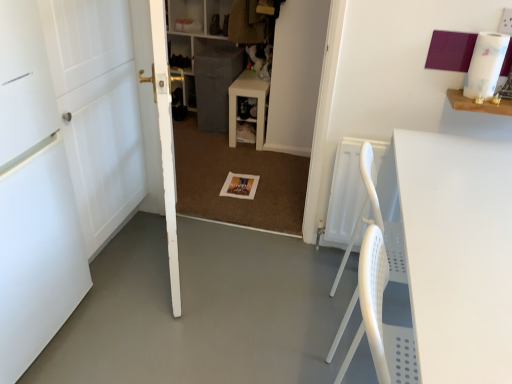
Identify the location of white matte table at right, positioned as the first table in bottom-to-top order. The height and width of the screenshot is (384, 512). (457, 254).

This screenshot has height=384, width=512. What are the coordinates of `white matte door at left, marked as the first door in a left-to-right arrangement` in the screenshot? It's located at (33, 199).

The width and height of the screenshot is (512, 384). I want to click on gray fabric cabinet at center, so click(x=215, y=84).

What do you see at coordinates (215, 84) in the screenshot?
I see `gray fabric cabinet at center` at bounding box center [215, 84].

This screenshot has height=384, width=512. What do you see at coordinates (296, 75) in the screenshot?
I see `gray fabric bookshelf at center` at bounding box center [296, 75].

Locate an element on the screen. The height and width of the screenshot is (384, 512). matte white table at center, arranged as the first table when viewed from the left is located at coordinates coord(248,97).

How much space does white wood door at left, marked as the second door in a left-to-right arrangement, occupy horizontally?

white wood door at left, marked as the second door in a left-to-right arrangement, is 52.31 centimeters wide.

At what (x,y) coordinates should I click in order to perform the action: click on white matte table at right, the 2th table positioned from the top. Please return your answer as a coordinate pair (x, y). The width and height of the screenshot is (512, 384). Looking at the image, I should click on (457, 254).

Is gray fabric cabinet at center further to the viewer compared to white matte table at right, the 2th table positioned from the top?

That is True.

Would you say gray fabric cabinet at center contains white matte table at right, the first table from the right?

No, white matte table at right, the first table from the right, is not inside gray fabric cabinet at center.

Which object is positioned more to the left, gray fabric cabinet at center or white matte table at right, the first table from the right?

gray fabric cabinet at center is more to the left.

Is point (216, 87) in front of point (485, 382)?

That is False.

Is white wooden door at left, the 3th door when ordered from left to right, far from gray fabric bookshelf at center?

white wooden door at left, the 3th door when ordered from left to right, is far away from gray fabric bookshelf at center.

From the image's perspective, who appears lower, white wooden door at left, which is counted as the 1th door, starting from the right, or gray fabric bookshelf at center?

From the image's view, white wooden door at left, which is counted as the 1th door, starting from the right, is below.

Could white matte table at right, the first table from the right, be considered to be inside white wood door at left, marked as the second door in a left-to-right arrangement?

No, white matte table at right, the first table from the right, is not inside white wood door at left, marked as the second door in a left-to-right arrangement.

Is white wood door at left, positioned as the 2th door in right-to-left order, not near white matte table at right, the 2th table positioned from the top?

Yes, white wood door at left, positioned as the 2th door in right-to-left order, is far from white matte table at right, the 2th table positioned from the top.

Considering the positions of objects white wood door at left, positioned as the 2th door in right-to-left order, and white matte table at right, which is the second table from left to right, in the image provided, who is in front, white wood door at left, positioned as the 2th door in right-to-left order, or white matte table at right, which is the second table from left to right,?

white matte table at right, which is the second table from left to right, is in front.

Is white wood door at left, positioned as the 2th door in right-to-left order, facing away from white matte table at right, the first table from the right?

No.

Does point (473, 280) appear closer or farther from the camera than point (32, 225)?

Point (473, 280).

Considering the sizes of objects white matte table at right, which ranks as the 2th table in back-to-front order, and white matte door at left, marked as the first door in a left-to-right arrangement, in the image provided, who is thinner, white matte table at right, which ranks as the 2th table in back-to-front order, or white matte door at left, marked as the first door in a left-to-right arrangement,?

Thinner between the two is white matte table at right, which ranks as the 2th table in back-to-front order.

Is white matte table at right, positioned as the first table in bottom-to-top order, positioned with its back to white matte door at left, the 3th door from the right?

Yes.

Is white matte table at right, which appears as the 1th table when viewed from the front, located outside white matte door at left, marked as the first door in a left-to-right arrangement?

white matte table at right, which appears as the 1th table when viewed from the front, is positioned outside white matte door at left, marked as the first door in a left-to-right arrangement.

Does matte white table at center, arranged as the first table when viewed from the left, have a lesser width compared to white matte door at left, marked as the first door in a left-to-right arrangement?

Yes, matte white table at center, arranged as the first table when viewed from the left, is thinner than white matte door at left, marked as the first door in a left-to-right arrangement.

Which object is closer to the camera, matte white table at center, positioned as the 2th table in bottom-to-top order, or white matte door at left, the 3th door from the right?

white matte door at left, the 3th door from the right, is in front.

Could you tell me if matte white table at center, positioned as the first table in top-to-bottom order, is turned towards white matte door at left, the 3th door from the right?

No.

Which is behind, point (61, 48) or point (259, 105)?

Point (259, 105)

Is white wood door at left, positioned as the 2th door in right-to-left order, positioned with its back to matte white table at center, which is counted as the 1th table, starting from the back?

No, matte white table at center, which is counted as the 1th table, starting from the back, is not at the back of white wood door at left, positioned as the 2th door in right-to-left order.

Between white wood door at left, positioned as the 2th door in right-to-left order, and matte white table at center, arranged as the first table when viewed from the left, which one has more height?

white wood door at left, positioned as the 2th door in right-to-left order, is taller.

Based on their sizes in the image, would you say white wood door at left, marked as the second door in a left-to-right arrangement, is bigger or smaller than matte white table at center, which is counted as the 2th table, starting from the front?

Considering their sizes, white wood door at left, marked as the second door in a left-to-right arrangement, takes up more space than matte white table at center, which is counted as the 2th table, starting from the front.

Is the depth of white matte door at left, the 3th door from the right, greater than that of gray fabric bookshelf at center?

No, the depth of white matte door at left, the 3th door from the right, is less than that of gray fabric bookshelf at center.

Is point (83, 249) farther from camera compared to point (179, 50)?

No.

Considering the sizes of objects white matte door at left, marked as the first door in a left-to-right arrangement, and gray fabric bookshelf at center in the image provided, who is wider, white matte door at left, marked as the first door in a left-to-right arrangement, or gray fabric bookshelf at center?

white matte door at left, marked as the first door in a left-to-right arrangement.

Considering the relative sizes of white matte door at left, the 3th door from the right, and gray fabric bookshelf at center in the image provided, is white matte door at left, the 3th door from the right, shorter than gray fabric bookshelf at center?

No.

The image size is (512, 384). There is a gray fabric cabinet at center. Find the location of `the 2nd table below it (from the image's perspective)`. the 2nd table below it (from the image's perspective) is located at coordinates (457, 254).

I want to click on bookshelf beneath the white wooden door at left, which is counted as the 1th door, starting from the right (from a real-world perspective), so click(x=296, y=75).

Based on their spatial positions, is white matte table at right, which ranks as the 2th table in back-to-front order, or gray fabric cabinet at center further from gray fabric bookshelf at center?

white matte table at right, which ranks as the 2th table in back-to-front order.

Based on their spatial positions, is white matte table at right, positioned as the first table in bottom-to-top order, or gray fabric bookshelf at center closer to gray fabric cabinet at center?

gray fabric bookshelf at center is closer to gray fabric cabinet at center.

When comparing their distances from white matte door at left, the 3th door from the right, does matte white table at center, arranged as the first table when viewed from the left, or white wooden door at left, which is counted as the 1th door, starting from the right, seem closer?

Among the two, white wooden door at left, which is counted as the 1th door, starting from the right, is located nearer to white matte door at left, the 3th door from the right.

Which object lies nearer to the anchor point white matte table at right, which ranks as the 2th table in back-to-front order, matte white table at center, positioned as the first table in top-to-bottom order, or white matte door at left, marked as the first door in a left-to-right arrangement?

The object closer to white matte table at right, which ranks as the 2th table in back-to-front order, is white matte door at left, marked as the first door in a left-to-right arrangement.

When comparing their distances from matte white table at center, positioned as the 2th table in bottom-to-top order, does white matte table at right, the first table from the right, or white wood door at left, positioned as the 2th door in right-to-left order, seem further?

The object further to matte white table at center, positioned as the 2th table in bottom-to-top order, is white matte table at right, the first table from the right.

Estimate the real-world distances between objects in this image. Which object is closer to gray fabric bookshelf at center, matte white table at center, positioned as the first table in top-to-bottom order, or gray fabric cabinet at center?

matte white table at center, positioned as the first table in top-to-bottom order.

Looking at the image, which one is located further to white matte table at right, positioned as the first table in bottom-to-top order, white wooden door at left, which is counted as the 1th door, starting from the right, or white wood door at left, marked as the second door in a left-to-right arrangement?

white wood door at left, marked as the second door in a left-to-right arrangement, lies further to white matte table at right, positioned as the first table in bottom-to-top order, than the other object.

Estimate the real-world distances between objects in this image. Which object is closer to gray fabric bookshelf at center, gray fabric cabinet at center or white wood door at left, marked as the second door in a left-to-right arrangement?

gray fabric cabinet at center is closer to gray fabric bookshelf at center.

Find the location of a particular element. The image size is (512, 384). bookshelf between white wooden door at left, the 3th door when ordered from left to right, and white matte table at right, which is the second table from left to right is located at coordinates (296, 75).

Locate an element on the screen. The width and height of the screenshot is (512, 384). door located between white wooden door at left, the 3th door when ordered from left to right, and gray fabric cabinet at center in the depth direction is located at coordinates (97, 110).

What are the coordinates of `bookshelf between white matte door at left, marked as the first door in a left-to-right arrangement, and white matte table at right, which appears as the 1th table when viewed from the front` in the screenshot? It's located at (296, 75).

Where is `table between white matte table at right, the first table from the right, and gray fabric cabinet at center, along the z-axis`? table between white matte table at right, the first table from the right, and gray fabric cabinet at center, along the z-axis is located at coordinates (248, 97).